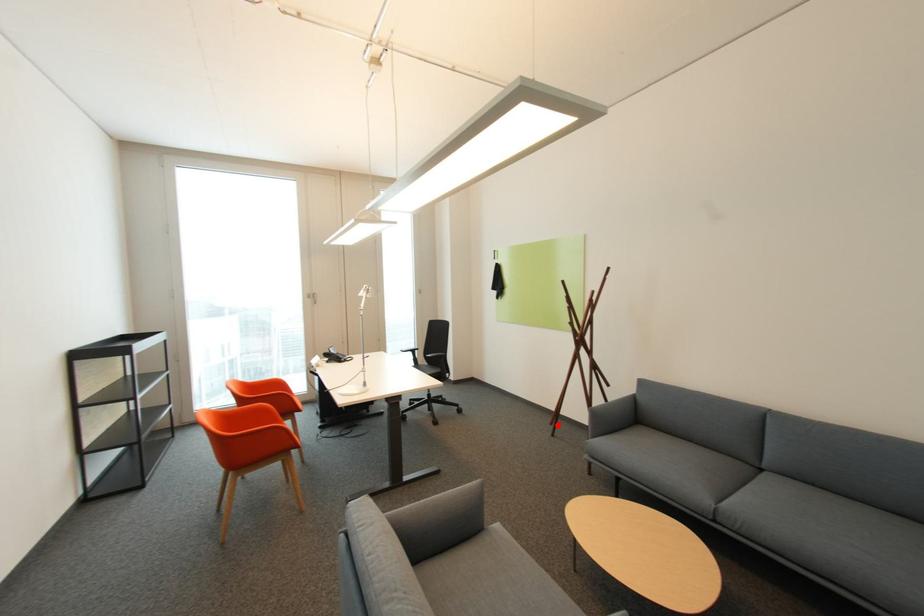
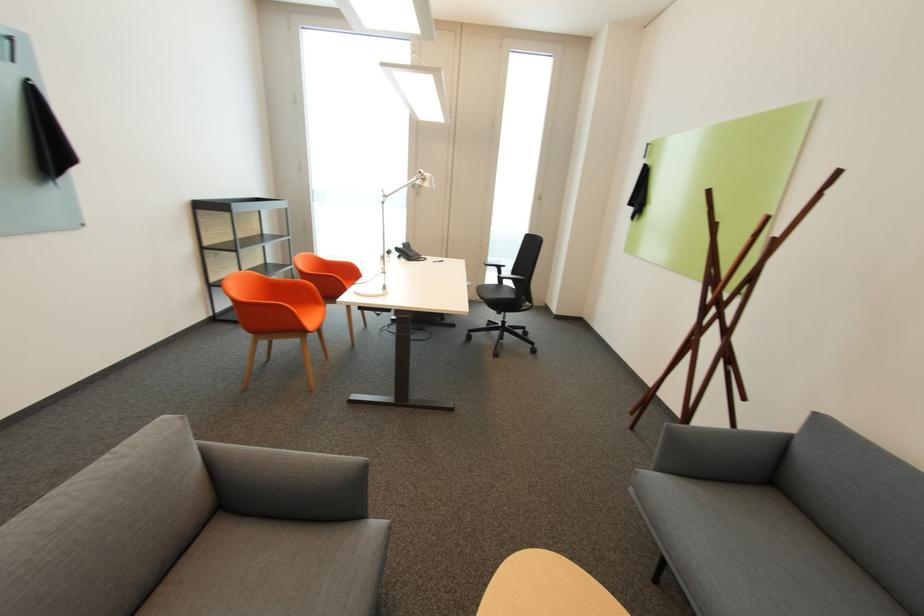
Question: I am providing you with two images of the same scene from different viewpoints. A red point is marked on the first image. Is the red point's position out of view in image 2?

Choices:
 (A) Yes
 (B) No

Answer: (B)